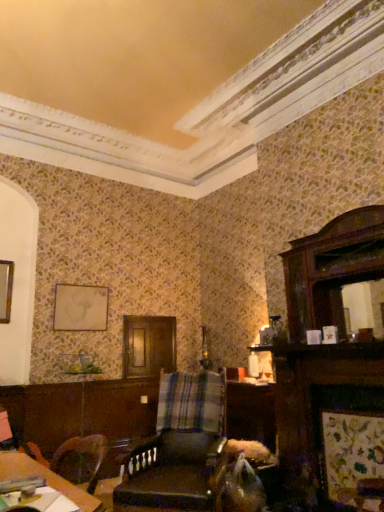
Question: Is wooden table at lower left oriented away from matte gold picture frame at upper left?

Choices:
 (A) no
 (B) yes

Answer: (A)

Question: Are wooden table at lower left and matte gold picture frame at upper left far apart?

Choices:
 (A) yes
 (B) no

Answer: (A)

Question: Is wooden table at lower left touching matte gold picture frame at upper left?

Choices:
 (A) yes
 (B) no

Answer: (B)

Question: From the image's perspective, would you say wooden table at lower left is positioned over matte gold picture frame at upper left?

Choices:
 (A) no
 (B) yes

Answer: (A)

Question: From a real-world perspective, is wooden table at lower left on top of matte gold picture frame at upper left?

Choices:
 (A) no
 (B) yes

Answer: (A)

Question: From a real-world perspective, is matte gold picture frame at upper left physically located above or below wooden table at lower left?

Choices:
 (A) below
 (B) above

Answer: (B)

Question: Is matte gold picture frame at upper left in front of or behind wooden table at lower left in the image?

Choices:
 (A) front
 (B) behind

Answer: (B)

Question: Does point (59, 323) appear closer or farther from the camera than point (89, 510)?

Choices:
 (A) farther
 (B) closer

Answer: (A)

Question: Considering the relative positions of matte gold picture frame at upper left and wooden table at lower left in the image provided, is matte gold picture frame at upper left to the left or to the right of wooden table at lower left?

Choices:
 (A) left
 (B) right

Answer: (A)

Question: From the image's perspective, relative to matte gold picture frame at upper left, is leather at center above or below?

Choices:
 (A) above
 (B) below

Answer: (B)

Question: Is leather at center wider or thinner than matte gold picture frame at upper left?

Choices:
 (A) wide
 (B) thin

Answer: (A)

Question: Considering their positions, is leather at center located in front of or behind matte gold picture frame at upper left?

Choices:
 (A) behind
 (B) front

Answer: (B)

Question: Which is correct: leather at center is inside matte gold picture frame at upper left, or outside of it?

Choices:
 (A) outside
 (B) inside

Answer: (A)

Question: Is wooden table at lower left in front of or behind leather at center in the image?

Choices:
 (A) behind
 (B) front

Answer: (B)

Question: Looking at their shapes, would you say wooden table at lower left is wider or thinner than leather at center?

Choices:
 (A) wide
 (B) thin

Answer: (B)